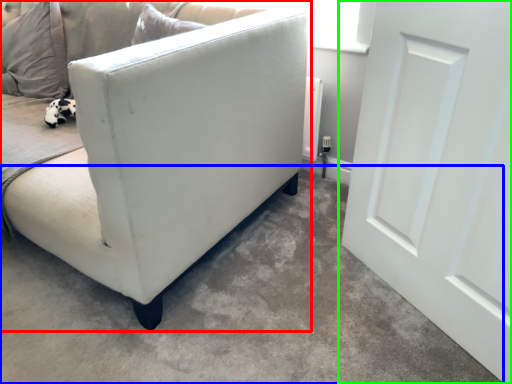
Question: Which object is positioned closest to studio couch (highlighted by a red box)? Select from concrete (highlighted by a blue box) and door (highlighted by a green box).

Choices:
 (A) concrete
 (B) door

Answer: (A)